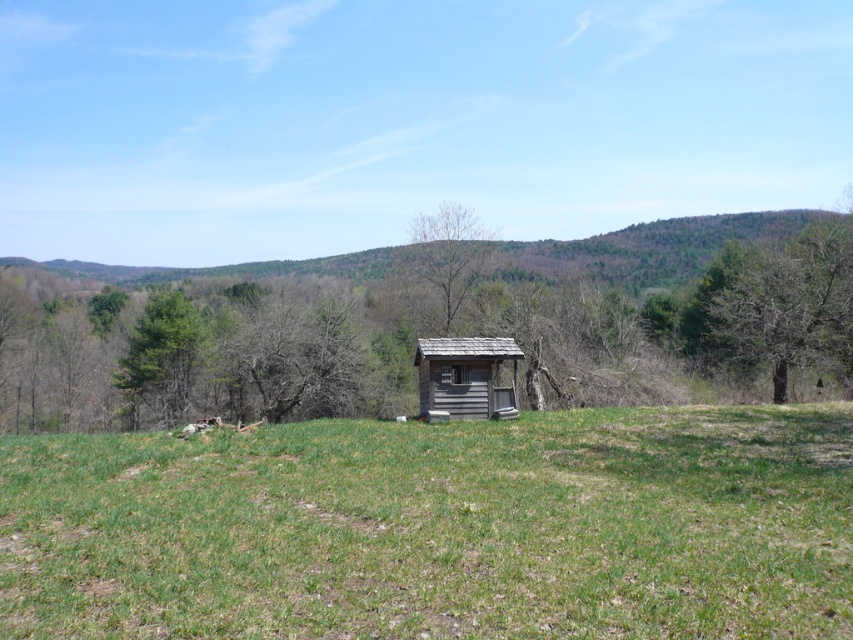
Question: In this image, where is brown wooden tree at center located relative to green leafy tree at right?

Choices:
 (A) left
 (B) right

Answer: (A)

Question: Does green grassy field at center have a larger size compared to bare wood tree at center?

Choices:
 (A) no
 (B) yes

Answer: (A)

Question: Considering the relative positions of green leafy tree at right and weathered wood hut at center in the image provided, where is green leafy tree at right located with respect to weathered wood hut at center?

Choices:
 (A) right
 (B) left

Answer: (A)

Question: Which of the following is the closest to the observer?

Choices:
 (A) (840, 300)
 (B) (317, 360)
 (C) (440, 253)

Answer: (A)

Question: Among these points, which one is farthest from the camera?

Choices:
 (A) (764, 604)
 (B) (126, 304)
 (C) (471, 260)

Answer: (B)

Question: Based on their relative distances, which object is farther from the bare wood tree at center?

Choices:
 (A) weathered wood hut at center
 (B) green grassy field at center
 (C) green leafy tree at right
 (D) brown wooden tree at center

Answer: (B)